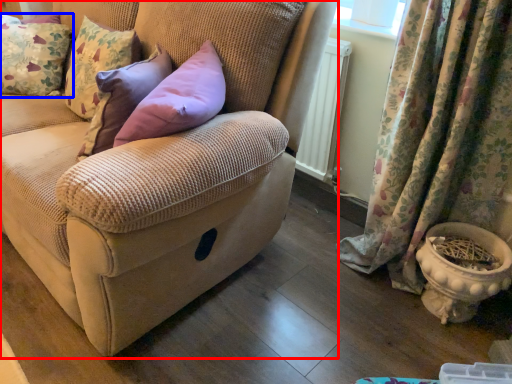
Question: Which object is further to the camera taking this photo, studio couch (highlighted by a red box) or pillow (highlighted by a blue box)?

Choices:
 (A) studio couch
 (B) pillow

Answer: (B)